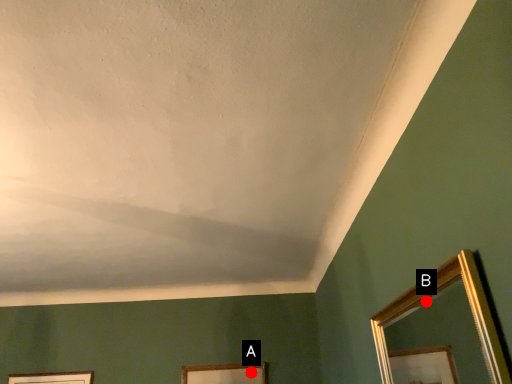
Question: Two points are circled on the image, labeled by A and B beside each circle. Which point is closer to the camera?

Choices:
 (A) A is closer
 (B) B is closer

Answer: (A)